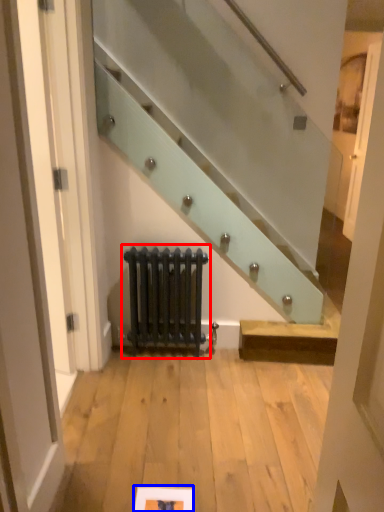
Question: Which point is closer to the camera, radiator (highlighted by a red box) or picture frame (highlighted by a blue box)?

Choices:
 (A) radiator
 (B) picture frame

Answer: (B)